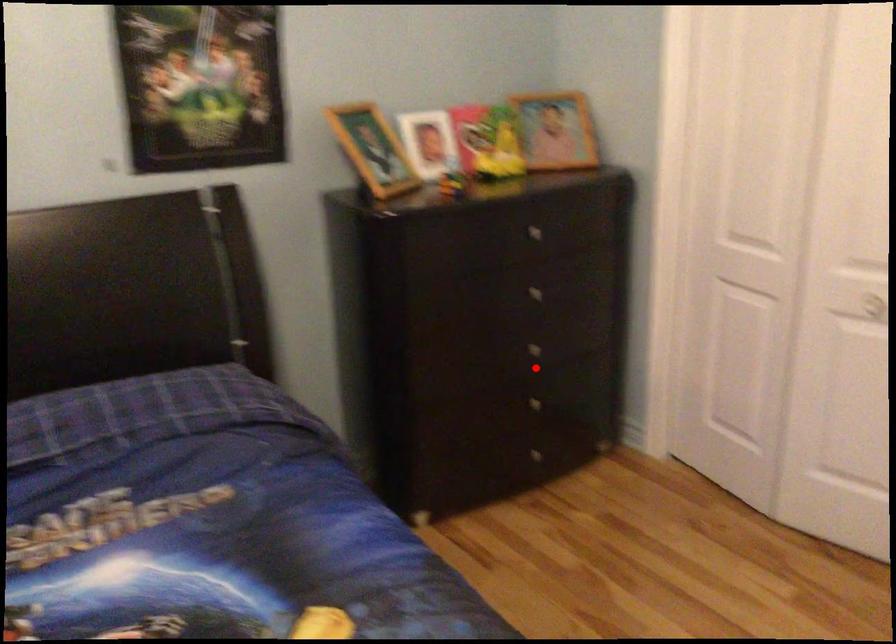
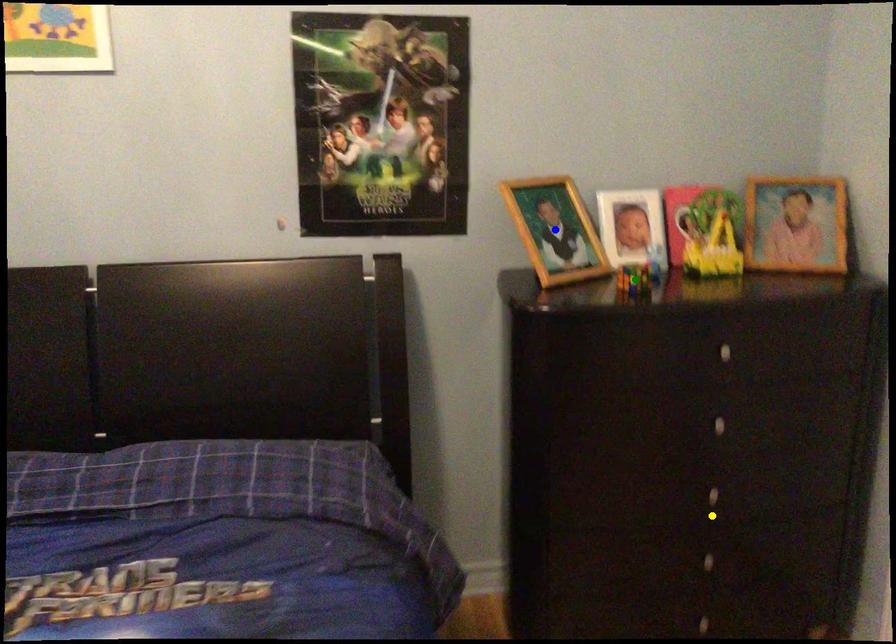
Question: I am providing you with two images of the same scene from different viewpoints. A red point is marked on the first image. You are given multiple points on the second image. Which point in image 2 represents the same 3d spot as the red point in image 1?

Choices:
 (A) yellow point
 (B) blue point
 (C) green point

Answer: (A)